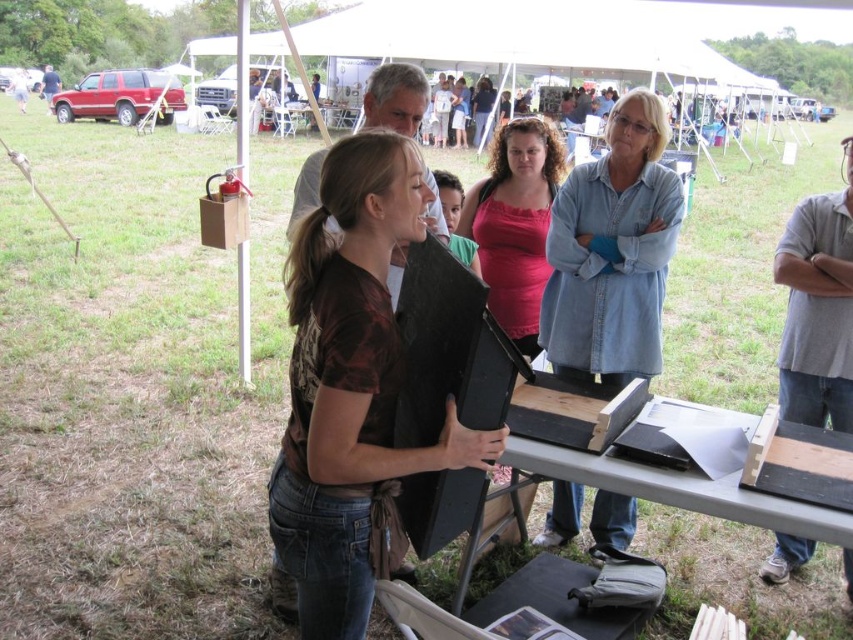
You are standing at the entrance of the tent and want to join the group around the wooden picnic table at center. Which direction should you walk to reach it?

The wooden picnic table at center is located at point [677,488], so you should walk towards the center of the tent to reach it.

You are standing at the same position as the camera and want to move towards the two points labeled point (651,468) and point (537,342). Which point should you aim for first if you want to reach the closer one first?

You should aim for point (651,468) first because it is closer to the camera than point (537,342).